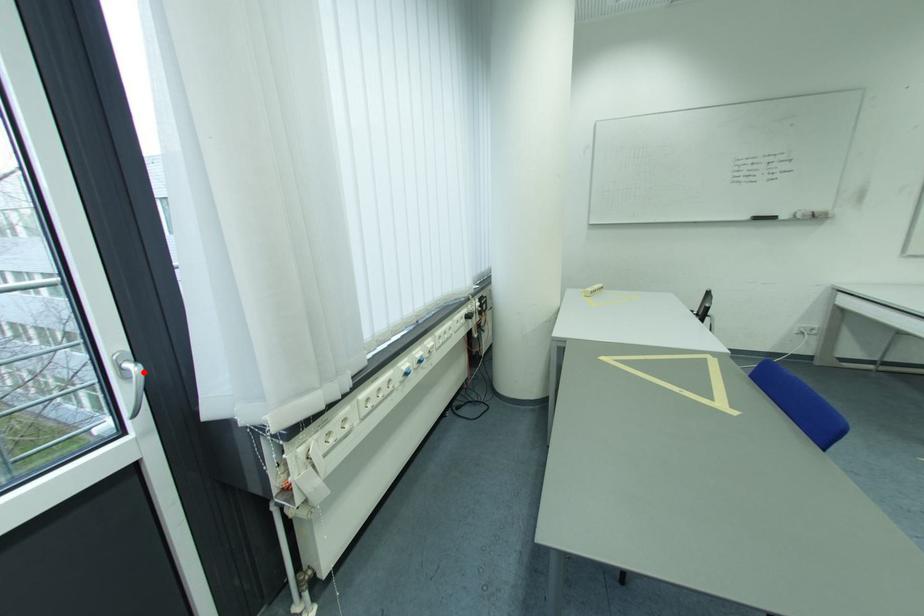
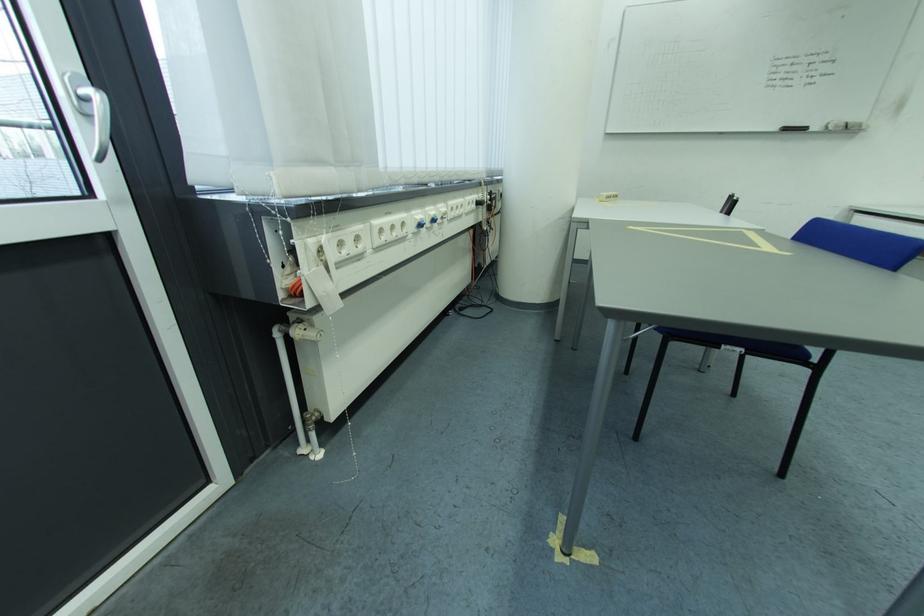
Question: I am providing you with two images of the same scene from different viewpoints. Image1 has a red point marked. In image2, the corresponding 3D location appears at what relative position? Reply with the corresponding letter.

Choices:
 (A) Closer
 (B) Farther

Answer: (B)